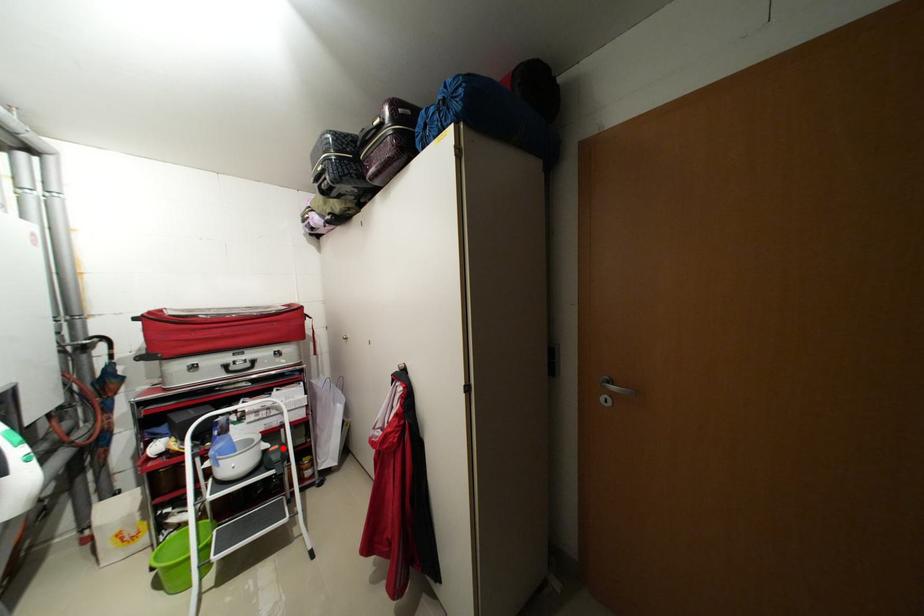
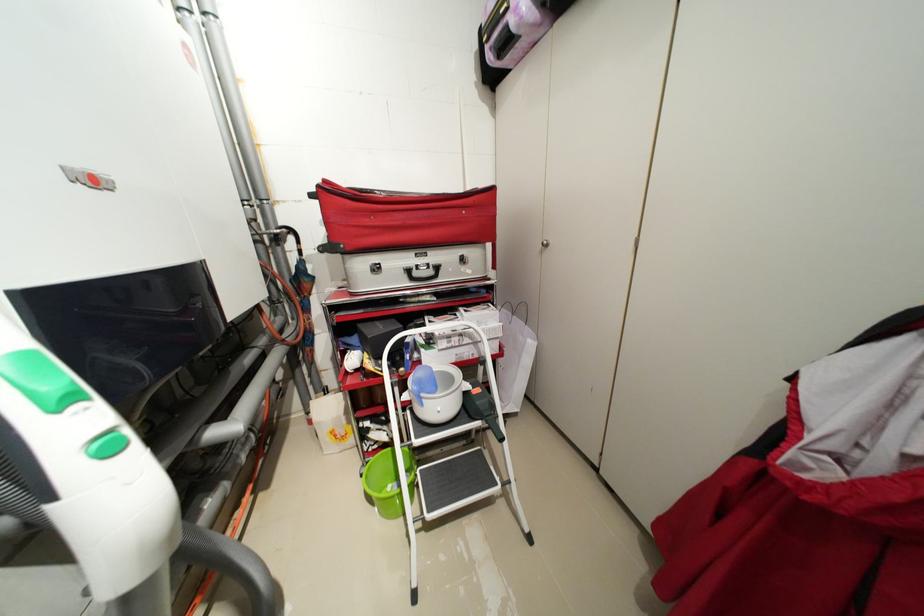
In the second image, find the point that corresponds to the highlighted location in the first image.

(484, 391)